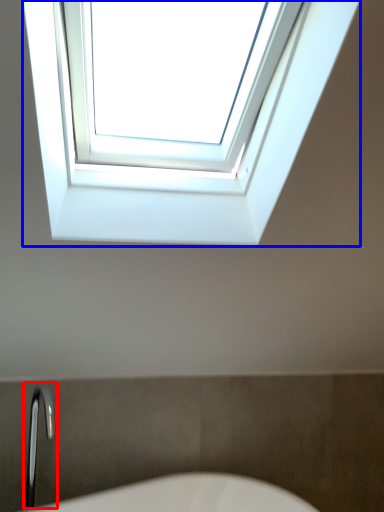
Question: Which object appears closest to the camera in this image, faucet (highlighted by a red box) or window (highlighted by a blue box)?

Choices:
 (A) faucet
 (B) window

Answer: (B)